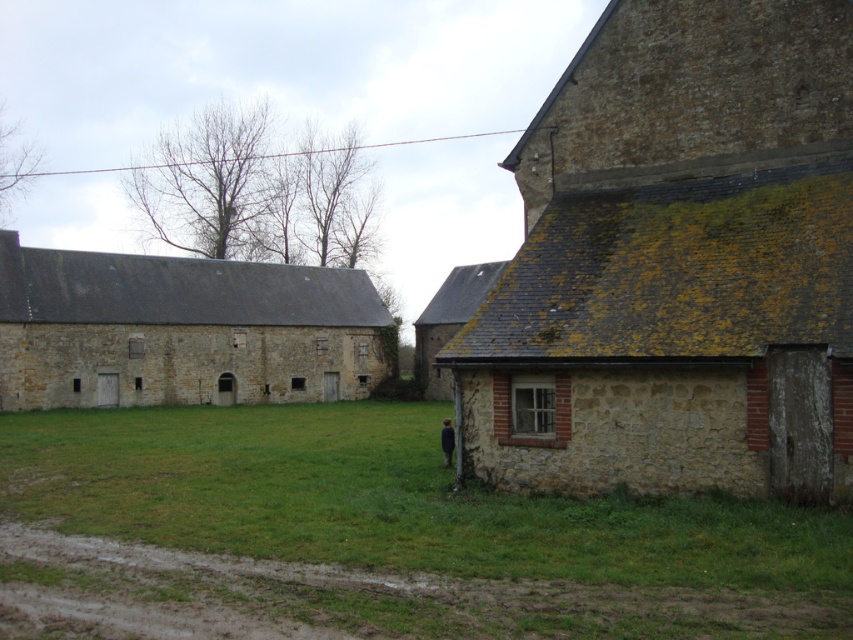
Looking at this image, you are a farmer standing in the field and want to determine which object is taller between the stone textured barn at right and the green grass at center. Based on the scene, which one is taller?

The stone textured barn at right is much taller than the green grass at center, so the barn is taller.

What is the 2D coordinate of the green grass at center?

The 2D coordinate of the green grass at center is at point (372, 538).

You are standing in the middle of the field between the stone barn at left and the stone textured barn at right. Which barn is higher up in elevation?

The stone textured barn at right is above the stone barn at left, so it is higher in elevation.